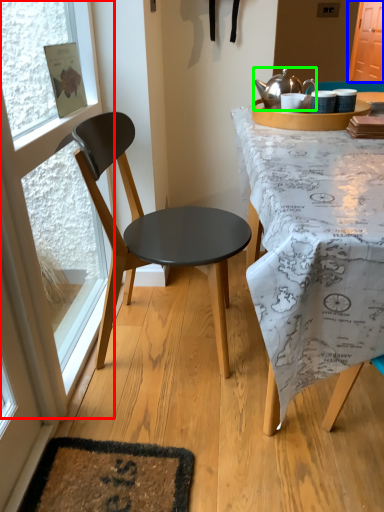
Question: Considering the real-world distances, which object is farthest from glass door (highlighted by a red box)? screen door (highlighted by a blue box) or kettle (highlighted by a green box)?

Choices:
 (A) screen door
 (B) kettle

Answer: (A)